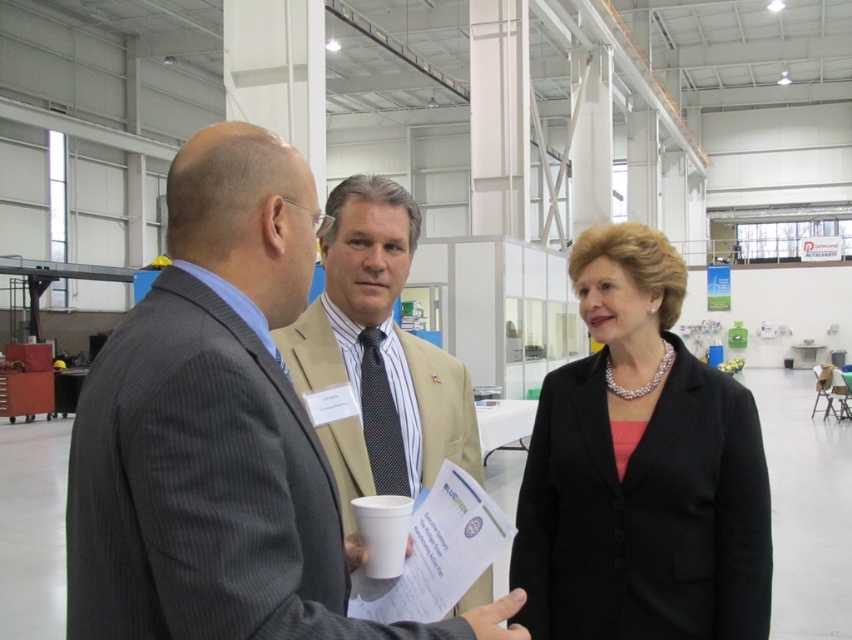
Does point (309, 614) come behind point (580, 584)?

That is False.

Can you confirm if gray pinstripe suit at center is thinner than matte black suit at center?

No, gray pinstripe suit at center is not thinner than matte black suit at center.

Is point (171, 611) closer to viewer compared to point (637, 310)?

Yes, it is.

Where is `gray pinstripe suit at center`? This screenshot has height=640, width=852. gray pinstripe suit at center is located at coordinates (203, 490).

Which is behind, point (200, 476) or point (367, 220)?

The point (367, 220) is behind.

Image resolution: width=852 pixels, height=640 pixels. What do you see at coordinates (203, 490) in the screenshot?
I see `gray pinstripe suit at center` at bounding box center [203, 490].

Locate an element on the screen. gray pinstripe suit at center is located at coordinates (203, 490).

Can you confirm if black satin blazer at center is positioned below beige fabric suit at center?

Correct, black satin blazer at center is located below beige fabric suit at center.

Based on the photo, who is more distant from viewer, [539,522] or [396,276]?

The point [539,522] is more distant.

What do you see at coordinates (642, 468) in the screenshot? The image size is (852, 640). I see `black satin blazer at center` at bounding box center [642, 468].

Where is `black satin blazer at center`? black satin blazer at center is located at coordinates (642, 468).